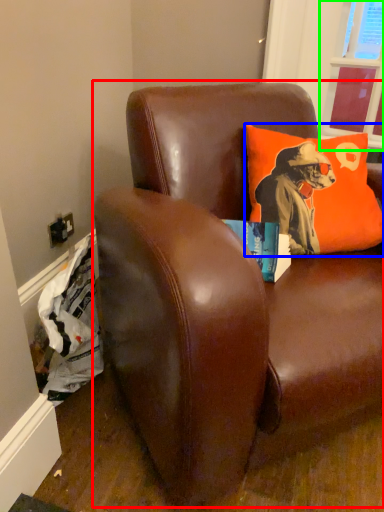
Question: Which object is positioned closest to studio couch (highlighted by a red box)? Select from pillow (highlighted by a blue box) and window screen (highlighted by a green box).

Choices:
 (A) pillow
 (B) window screen

Answer: (A)